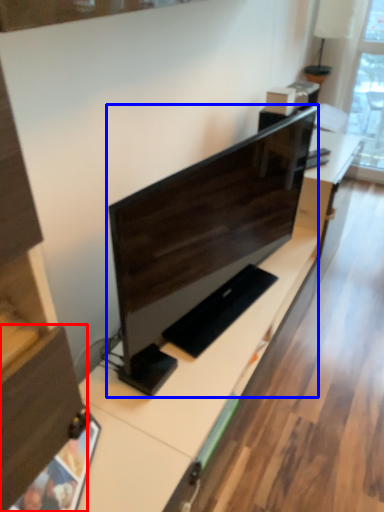
Question: Which of the following is the farthest to the observer, drawer (highlighted by a red box) or computer monitor (highlighted by a blue box)?

Choices:
 (A) drawer
 (B) computer monitor

Answer: (B)